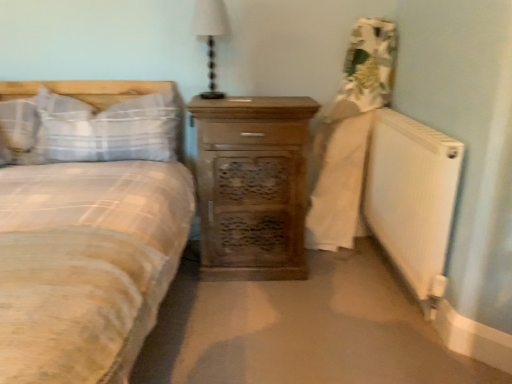
This screenshot has height=384, width=512. I want to click on empty space that is ontop of white matte radiator at lower right (from a real-world perspective), so click(399, 115).